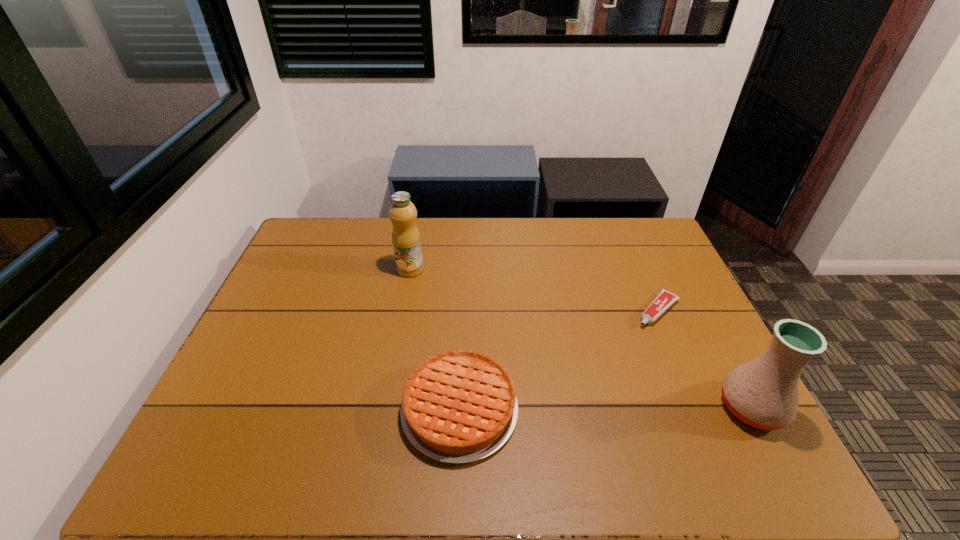
This screenshot has height=540, width=960. I want to click on vacant space located on the front label of the fruit juice, so click(x=464, y=310).

Find the location of `vacant space located on the front label of the fruit juice`. vacant space located on the front label of the fruit juice is located at coordinates (492, 333).

This screenshot has height=540, width=960. I want to click on vacant space positioned on the front label of the fruit juice, so click(x=439, y=291).

Identify the location of pie located in the near edge section of the desktop. The height and width of the screenshot is (540, 960). (459, 406).

Locate an element on the screen. This screenshot has width=960, height=540. pottery that is at the near edge is located at coordinates (764, 393).

At what (x,y) coordinates should I click in order to perform the action: click on pottery that is at the right edge. Please return your answer as a coordinate pair (x, y). Image resolution: width=960 pixels, height=540 pixels. Looking at the image, I should click on (764, 393).

You are a GUI agent. You are given a task and a screenshot of the screen. Output one action in this format:
    pyautogui.click(x=<x>, y=<y>)
    Task: Click on the toothpaste located at the right edge
    
    Given the screenshot: What is the action you would take?
    pyautogui.click(x=665, y=299)

Locate an element on the screen. This screenshot has width=960, height=540. object located at the near right corner is located at coordinates (764, 393).

Image resolution: width=960 pixels, height=540 pixels. In the image, there is a desktop. What are the coordinates of `vacant space at the far edge` in the screenshot? It's located at (567, 218).

Where is `free space at the near edge of the desktop`? This screenshot has width=960, height=540. free space at the near edge of the desktop is located at coordinates (630, 424).